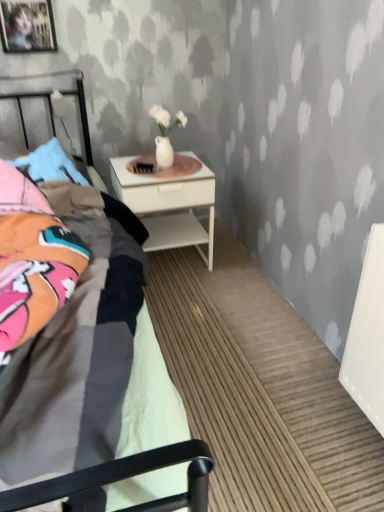
Describe the element at coordinates (168, 205) in the screenshot. I see `white glossy nightstand at center` at that location.

The image size is (384, 512). What do you see at coordinates (249, 121) in the screenshot?
I see `white textured wall at upper center` at bounding box center [249, 121].

Locate an element on the screen. The image size is (384, 512). wooden picture frame at upper left is located at coordinates (27, 26).

Is white glossy nightstand at center surrounded by wooden picture frame at upper left?

Actually, white glossy nightstand at center is outside wooden picture frame at upper left.

From a real-world perspective, is wooden picture frame at upper left positioned above or below white glossy nightstand at center?

wooden picture frame at upper left is situated higher than white glossy nightstand at center in the real world.

Is wooden picture frame at upper left positioned far away from white glossy nightstand at center?

That's not correct — wooden picture frame at upper left is a little close to white glossy nightstand at center.

Considering the positions of points (8, 25) and (176, 189), is point (8, 25) farther from camera compared to point (176, 189)?

Yes, it is.

Where is `backdrop on the right of wooden picture frame at upper left`? This screenshot has width=384, height=512. backdrop on the right of wooden picture frame at upper left is located at coordinates (249, 121).

Is white textured wall at upper center surrounding wooden picture frame at upper left?

Definitely not — wooden picture frame at upper left is not inside white textured wall at upper center.

Is white textured wall at upper center next to wooden picture frame at upper left?

No, white textured wall at upper center is not next to wooden picture frame at upper left.

From the picture: From the image's perspective, which one is positioned higher, white glossy nightstand at center or wooden picture frame at upper left?

From the image's view, wooden picture frame at upper left is above.

Which object is closer to the camera taking this photo, white glossy nightstand at center or wooden picture frame at upper left?

white glossy nightstand at center is more forward.

Is white glossy nightstand at center shorter than wooden picture frame at upper left?

No, white glossy nightstand at center is not shorter than wooden picture frame at upper left.

Is white glossy nightstand at center spatially inside wooden picture frame at upper left, or outside of it?

white glossy nightstand at center is outside wooden picture frame at upper left.

Would you consider wooden picture frame at upper left to be distant from white textured wall at upper center?

No, there isn't a large distance between wooden picture frame at upper left and white textured wall at upper center.

Which object is thinner, wooden picture frame at upper left or white textured wall at upper center?

wooden picture frame at upper left is thinner.

Considering the points (208, 177) and (243, 1), which point is behind, point (208, 177) or point (243, 1)?

Point (243, 1)

Between white glossy nightstand at center and white textured wall at upper center, which one appears on the left side from the viewer's perspective?

white textured wall at upper center is more to the left.

Is white glossy nightstand at center aimed at white textured wall at upper center?

No, white glossy nightstand at center is not aimed at white textured wall at upper center.

Can white textured wall at upper center be found inside white glossy nightstand at center?

Actually, white textured wall at upper center is outside white glossy nightstand at center.

How many degrees apart are the facing directions of white textured wall at upper center and white glossy nightstand at center?

The facing directions of white textured wall at upper center and white glossy nightstand at center are 0.549 degrees apart.

Is white textured wall at upper center taller than white glossy nightstand at center?

Result: Correct, white textured wall at upper center is much taller as white glossy nightstand at center.

From a real-world perspective, which object rests below the other?

white glossy nightstand at center is physically lower.

Considering the positions of point (292, 2) and point (177, 186), is point (292, 2) closer or farther from the camera than point (177, 186)?

Point (292, 2).

Where is `picture frame behind the white glossy nightstand at center`? This screenshot has width=384, height=512. picture frame behind the white glossy nightstand at center is located at coordinates (27, 26).

What are the coordinates of `backdrop located below the wooden picture frame at upper left (from the image's perspective)` in the screenshot? It's located at (249, 121).

From the image, which object appears to be farther from white glossy nightstand at center, white textured wall at upper center or wooden picture frame at upper left?

wooden picture frame at upper left is further to white glossy nightstand at center.

From the image, which object appears to be nearer to white textured wall at upper center, wooden picture frame at upper left or white glossy nightstand at center?

white glossy nightstand at center lies closer to white textured wall at upper center than the other object.

Estimate the real-world distances between objects in this image. Which object is closer to wooden picture frame at upper left, white glossy nightstand at center or white textured wall at upper center?

The object closer to wooden picture frame at upper left is white textured wall at upper center.

Considering their positions, is white glossy nightstand at center positioned further to white textured wall at upper center than wooden picture frame at upper left?

wooden picture frame at upper left is positioned further to the anchor white textured wall at upper center.

From the image, which object appears to be nearer to white glossy nightstand at center, wooden picture frame at upper left or white textured wall at upper center?

white textured wall at upper center is closer to white glossy nightstand at center.

Estimate the real-world distances between objects in this image. Which object is closer to wooden picture frame at upper left, white textured wall at upper center or white glossy nightstand at center?

Among the two, white textured wall at upper center is located nearer to wooden picture frame at upper left.

At what (x,y) coordinates should I click in order to perform the action: click on nightstand between white textured wall at upper center and wooden picture frame at upper left from front to back. Please return your answer as a coordinate pair (x, y). Looking at the image, I should click on (168, 205).